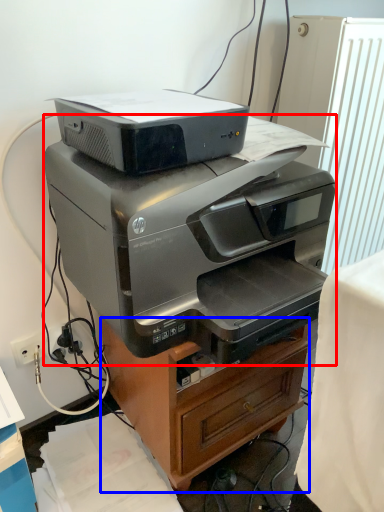
Question: Among these objects, which one is nearest to the camera, printer (highlighted by a red box) or furniture (highlighted by a blue box)?

Choices:
 (A) printer
 (B) furniture

Answer: (A)